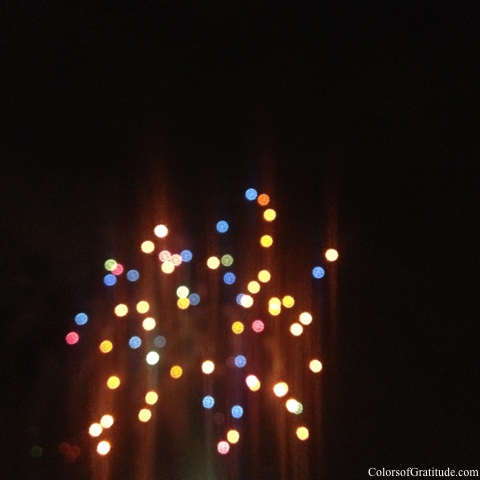
The height and width of the screenshot is (480, 480). I want to click on left most pink light, so click(x=69, y=338).